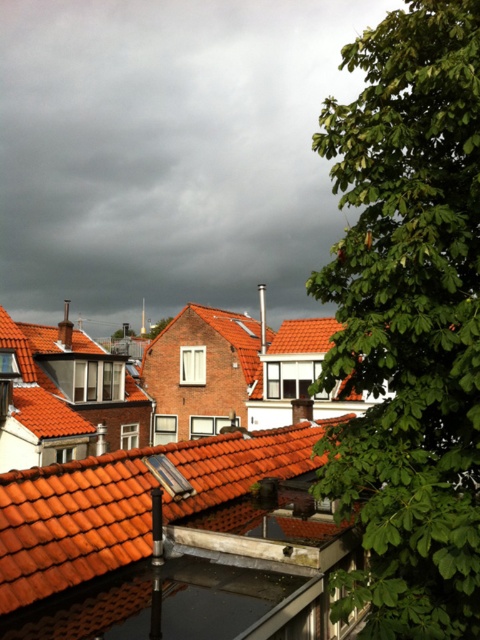
You are standing in the residential area and looking at the orange clay tiles at center and the green leafy tree at center. Which object is positioned to the right side?

The orange clay tiles at center are to the right of the green leafy tree at center.

You are standing in the residential area described in the scene. You want to locate the green leafy tree at right. According to the coordinates provided, where should you look relative to the center of the image?

The green leafy tree at right is located at coordinates point [408,320], which means it is exactly at the center horizontally and slightly above the center vertically relative to the image.